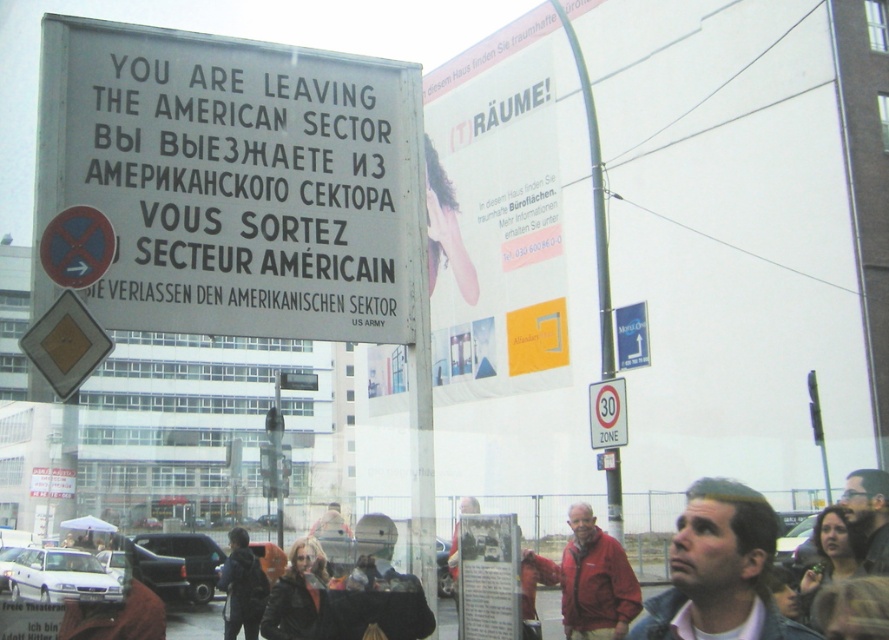
Question: Which point appears closest to the camera in this image?

Choices:
 (A) (241, 547)
 (B) (621, 621)
 (C) (861, 506)

Answer: (C)

Question: Which of the following is the closest to the observer?

Choices:
 (A) (606, 448)
 (B) (574, 636)
 (C) (874, 560)
 (D) (179, 122)

Answer: (C)

Question: Is the position of leather jacket at center more distant than that of dark brown leather jacket at lower right?

Choices:
 (A) no
 (B) yes

Answer: (B)

Question: Is dark blue jacket at lower left thinner than dark brown leather jacket at lower right?

Choices:
 (A) yes
 (B) no

Answer: (B)

Question: Which of the following is the closest to the observer?

Choices:
 (A) metallic pole at center-right
 (B) dark hair at lower right

Answer: (B)

Question: Where is metallic pole at center-right located in relation to dark hair at lower right in the image?

Choices:
 (A) right
 (B) left

Answer: (B)